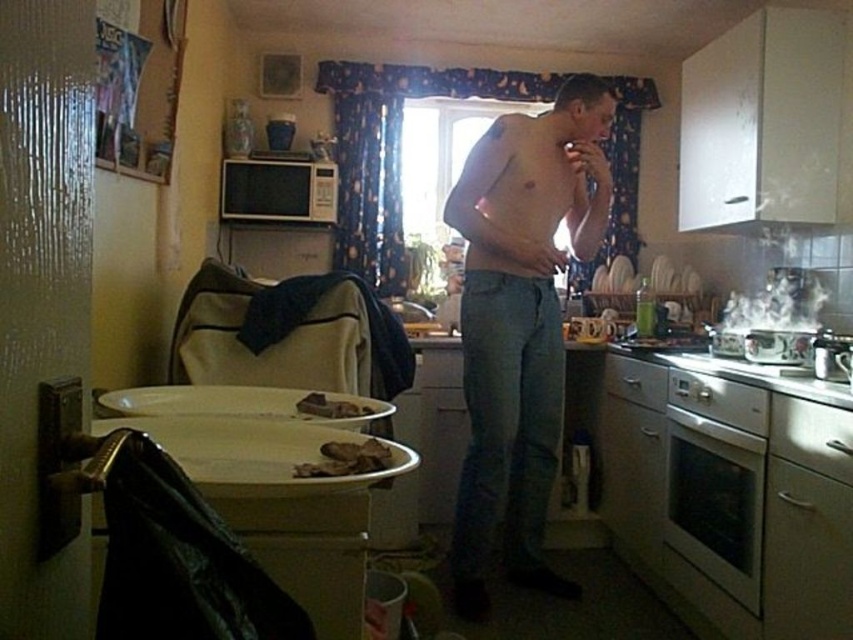
Question: Which object appears closest to the camera in this image?

Choices:
 (A) white matte microwave at upper center
 (B) denim jeans at center
 (C) brown crumbly meat at center
 (D) white glossy oven at lower right

Answer: (C)

Question: Is white glossy exhaust hood at upper right below white matte microwave at upper center?

Choices:
 (A) yes
 (B) no

Answer: (B)

Question: Is white matte microwave at upper center in front of brown crumbly bread at center?

Choices:
 (A) yes
 (B) no

Answer: (B)

Question: Is white glossy oven at lower right to the right of brown crumbly meat at center from the viewer's perspective?

Choices:
 (A) yes
 (B) no

Answer: (A)

Question: Which of the following is the closest to the observer?

Choices:
 (A) (759, 109)
 (B) (520, 224)

Answer: (B)

Question: Among these points, which one is farthest from the camera?

Choices:
 (A) (357, 404)
 (B) (491, 387)
 (C) (753, 476)
 (D) (318, 308)

Answer: (B)